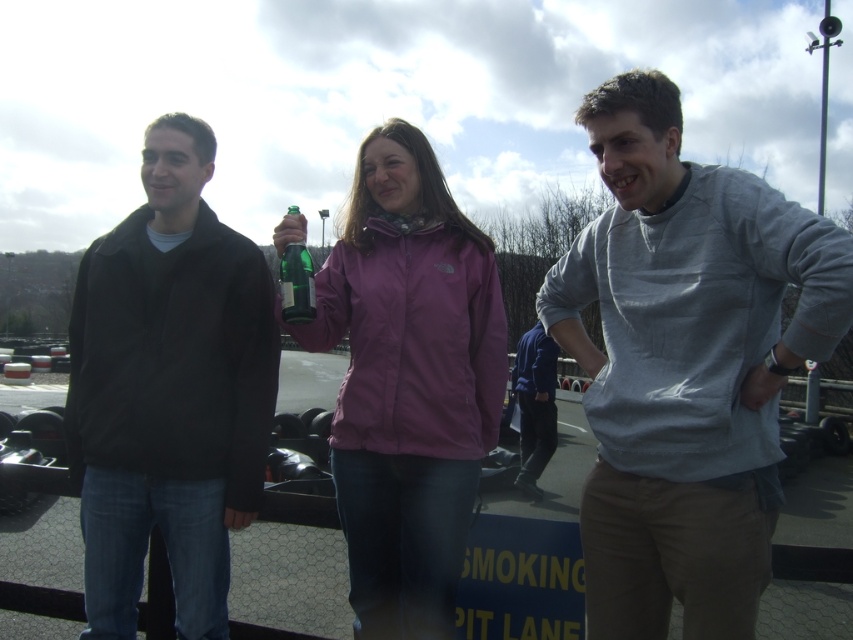
Is point (727, 435) positioned before point (520, 488)?

Yes.

Which of these two, gray cotton shirt at center or blue fleece jacket at center, stands taller?

gray cotton shirt at center is taller.

What do you see at coordinates (685, 365) in the screenshot? I see `gray cotton shirt at center` at bounding box center [685, 365].

This screenshot has height=640, width=853. What are the coordinates of `gray cotton shirt at center` in the screenshot? It's located at (685, 365).

Is gray cotton shirt at center closer to the viewer compared to matte black jacket at left?

Yes, it is.

Between gray cotton shirt at center and matte black jacket at left, which one has more height?

matte black jacket at left

Locate an element on the screen. This screenshot has width=853, height=640. gray cotton shirt at center is located at coordinates (685, 365).

Is matte black jacket at left above blue fleece jacket at center?

Yes.

Does matte black jacket at left have a smaller size compared to blue fleece jacket at center?

Incorrect, matte black jacket at left is not smaller in size than blue fleece jacket at center.

The width and height of the screenshot is (853, 640). What do you see at coordinates (167, 390) in the screenshot? I see `matte black jacket at left` at bounding box center [167, 390].

Locate an element on the screen. The width and height of the screenshot is (853, 640). matte black jacket at left is located at coordinates (167, 390).